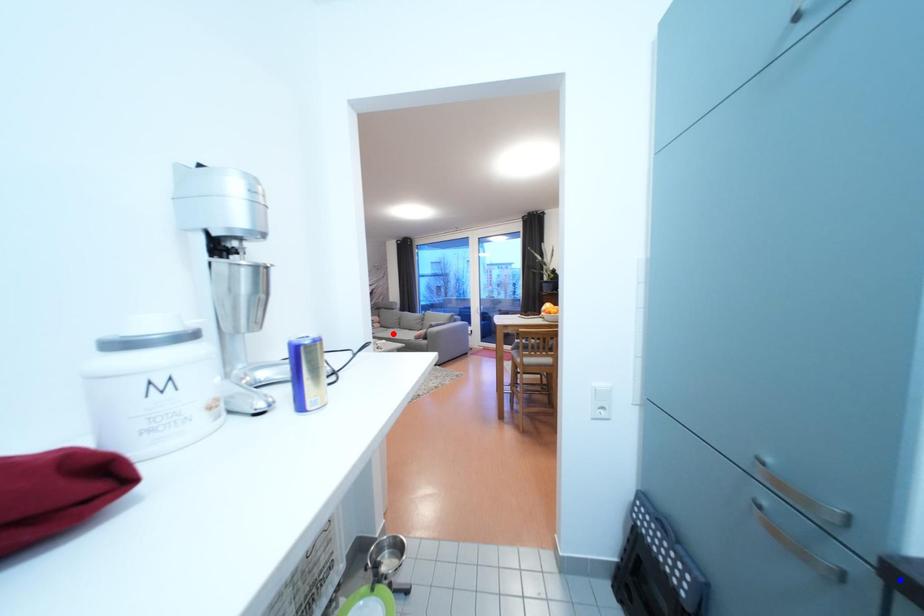
Question: In the image, two points are highlighted. Which point is nearer to the camera? Reply with the corresponding letter.

Choices:
 (A) blue point
 (B) red point

Answer: (A)